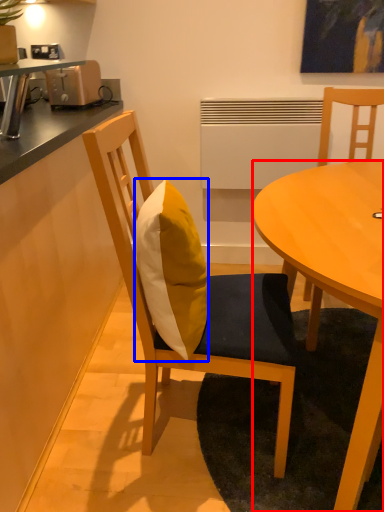
Question: Which object appears farthest to the camera in this image, desk (highlighted by a red box) or pillow (highlighted by a blue box)?

Choices:
 (A) desk
 (B) pillow

Answer: (B)